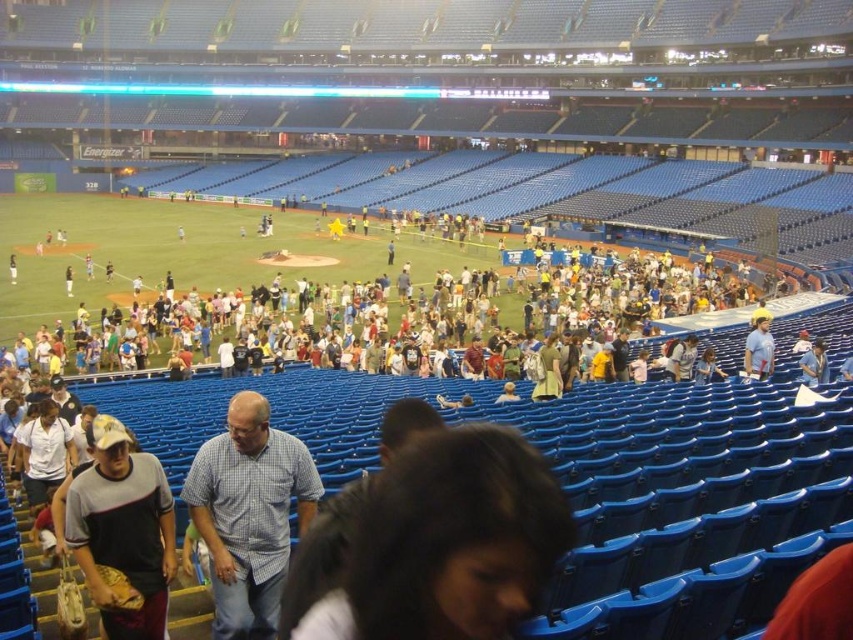
Is dark brown hair at center thinner than light blue shirt at right?

No, dark brown hair at center is not thinner than light blue shirt at right.

Between point (418, 465) and point (746, 372), which one is positioned in front?

Point (418, 465) is more forward.

Does point (523, 608) lie behind point (759, 321)?

No, it is in front of (759, 321).

Locate an element on the screen. Image resolution: width=853 pixels, height=640 pixels. dark brown hair at center is located at coordinates (450, 541).

Based on the photo, is dark brown hair at center in front of gray cotton t-shirt at lower left?

Yes, it is in front of gray cotton t-shirt at lower left.

Which of these two, dark brown hair at center or gray cotton t-shirt at lower left, stands shorter?

With less height is gray cotton t-shirt at lower left.

Is point (479, 476) closer to viewer compared to point (91, 493)?

Yes, it is.

The width and height of the screenshot is (853, 640). Identify the location of dark brown hair at center. (450, 541).

Does dark brown hair at center appear over checkered fabric shirt at center?

Indeed, dark brown hair at center is positioned over checkered fabric shirt at center.

Who is positioned more to the left, dark brown hair at center or checkered fabric shirt at center?

From the viewer's perspective, checkered fabric shirt at center appears more on the left side.

You are a GUI agent. You are given a task and a screenshot of the screen. Output one action in this format:
    pyautogui.click(x=<x>, y=<y>)
    Task: Click on the dark brown hair at center
    Image resolution: width=853 pixels, height=640 pixels.
    Given the screenshot: What is the action you would take?
    pyautogui.click(x=450, y=541)